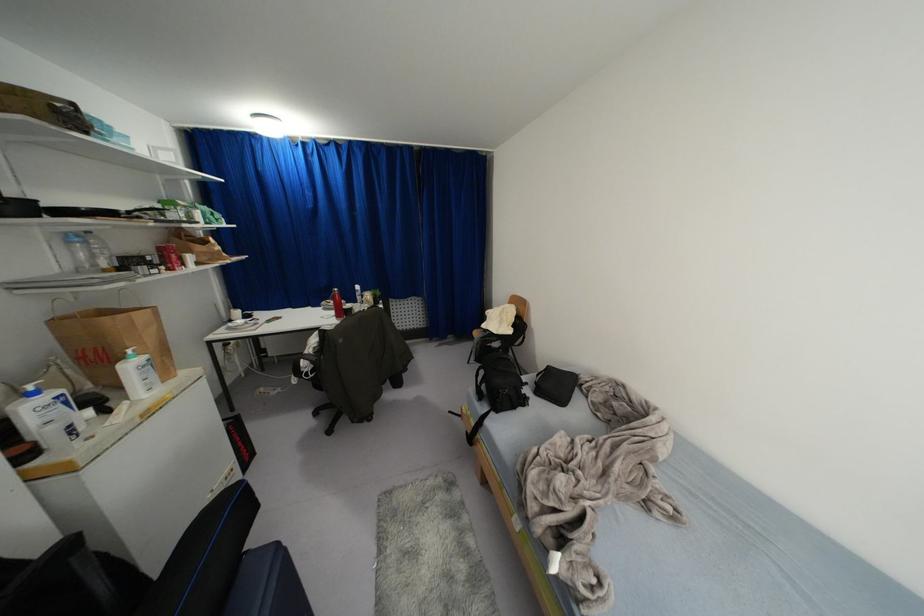
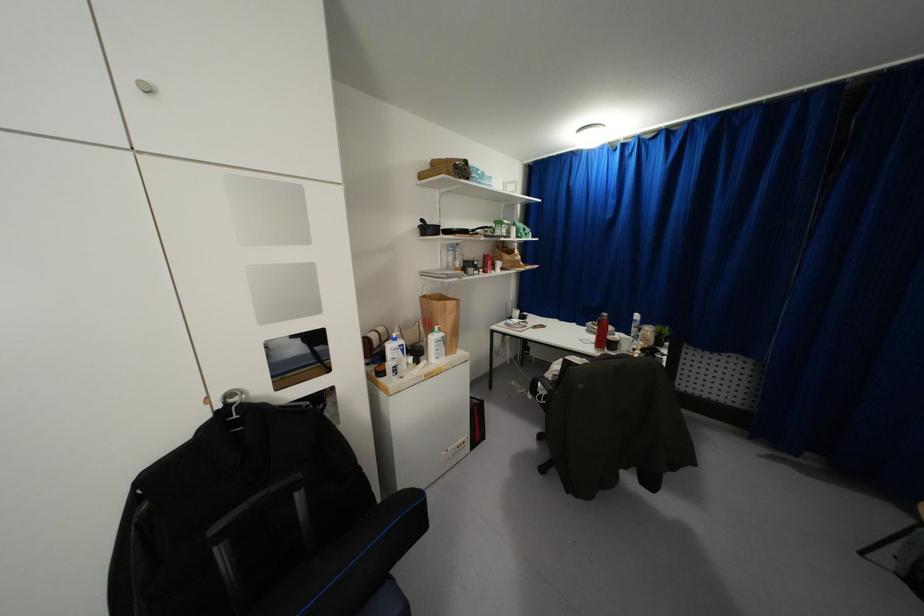
The point at (x=142, y=355) is marked in the first image. Where is the corresponding point in the second image?

(442, 333)